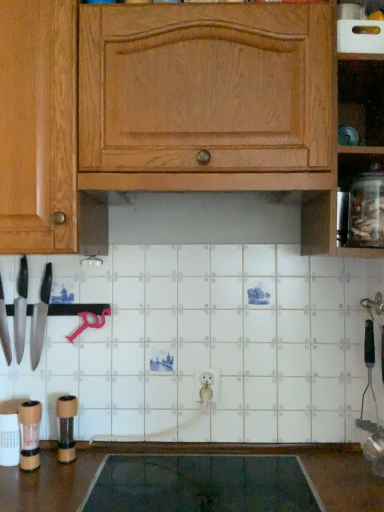
Describe the element at coordinates (29, 434) in the screenshot. I see `wooden pepper grinder at lower left, arranged as the 2th appliance when viewed from the right` at that location.

Describe the element at coordinates (20, 310) in the screenshot. I see `polished silver knife at left, the 2th knife viewed from the left` at that location.

Where is `wooden pepper grinder at lower left, which appears as the 1th appliance when viewed from the left`? The image size is (384, 512). wooden pepper grinder at lower left, which appears as the 1th appliance when viewed from the left is located at coordinates (29, 434).

From a real-world perspective, does shiny silver knife at left, which is the third knife in right-to-left order, sit lower than dark gray rubber mat at lower center?

No, from a real-world perspective, shiny silver knife at left, which is the third knife in right-to-left order, is not under dark gray rubber mat at lower center.

Consider the image. Considering the sizes of objects shiny silver knife at left, which appears as the 1th knife when viewed from the left, and dark gray rubber mat at lower center in the image provided, who is thinner, shiny silver knife at left, which appears as the 1th knife when viewed from the left, or dark gray rubber mat at lower center?

shiny silver knife at left, which appears as the 1th knife when viewed from the left, is thinner.

Are shiny silver knife at left, which is the third knife in right-to-left order, and dark gray rubber mat at lower center beside each other?

shiny silver knife at left, which is the third knife in right-to-left order, is not next to dark gray rubber mat at lower center, and they're not touching.

Are wooden pepper grinder at lower left, which appears as the 1th appliance when viewed from the left, and matte black knife at left, marked as the 3th knife in a left-to-right arrangement, far apart?

No.

Is wooden pepper grinder at lower left, arranged as the 2th appliance when viewed from the right, thinner than matte black knife at left, marked as the 3th knife in a left-to-right arrangement?

Correct, the width of wooden pepper grinder at lower left, arranged as the 2th appliance when viewed from the right, is less than that of matte black knife at left, marked as the 3th knife in a left-to-right arrangement.

Based on the photo, considering the positions of objects wooden pepper grinder at lower left, which is counted as the second appliance, starting from the back, and matte black knife at left, marked as the 3th knife in a left-to-right arrangement, in the image provided, who is in front, wooden pepper grinder at lower left, which is counted as the second appliance, starting from the back, or matte black knife at left, marked as the 3th knife in a left-to-right arrangement,?

wooden pepper grinder at lower left, which is counted as the second appliance, starting from the back, is closer to the camera.

Which is less distant, (327, 459) or (207, 18)?

Point (327, 459) is farther from the camera than point (207, 18).

From a real-world perspective, which object rests below the other?

dark gray rubber mat at lower center.

From the picture: Is shiny silver knife at left, which is the third knife in right-to-left order, positioned far away from brown matte pepper grinder at lower left, positioned as the second appliance in front-to-back order?

No, shiny silver knife at left, which is the third knife in right-to-left order, is in close proximity to brown matte pepper grinder at lower left, positioned as the second appliance in front-to-back order.

Considering the positions of objects shiny silver knife at left, which appears as the 1th knife when viewed from the left, and brown matte pepper grinder at lower left, placed as the first appliance when sorted from right to left, in the image provided, who is more to the left, shiny silver knife at left, which appears as the 1th knife when viewed from the left, or brown matte pepper grinder at lower left, placed as the first appliance when sorted from right to left,?

Positioned to the left is shiny silver knife at left, which appears as the 1th knife when viewed from the left.

What's the angular difference between shiny silver knife at left, which is the third knife in right-to-left order, and brown matte pepper grinder at lower left, positioned as the second appliance in left-to-right order,'s facing directions?

6.64 degrees.

Is shiny silver knife at left, which appears as the 1th knife when viewed from the left, not inside brown matte pepper grinder at lower left, positioned as the second appliance in front-to-back order?

Yes.

Could you tell me if clear glass jar at right is turned towards dark gray rubber mat at lower center?

No, clear glass jar at right does not turn towards dark gray rubber mat at lower center.

Does clear glass jar at right lie in front of dark gray rubber mat at lower center?

No, clear glass jar at right is further to the viewer.

Could dark gray rubber mat at lower center be considered to be inside clear glass jar at right?

No, dark gray rubber mat at lower center is not a part of clear glass jar at right.

From the image's perspective, is clear glass jar at right located above or below dark gray rubber mat at lower center?

clear glass jar at right is situated higher than dark gray rubber mat at lower center in the image.

Is brown matte pepper grinder at lower left, which is the first appliance from back to front, wider or thinner than wooden pepper grinder at lower left, which appears as the 1th appliance when viewed from the left?

Clearly, brown matte pepper grinder at lower left, which is the first appliance from back to front, has more width compared to wooden pepper grinder at lower left, which appears as the 1th appliance when viewed from the left.

Which is more to the right, brown matte pepper grinder at lower left, placed as the first appliance when sorted from right to left, or wooden pepper grinder at lower left, which is counted as the second appliance, starting from the back?

brown matte pepper grinder at lower left, placed as the first appliance when sorted from right to left, is more to the right.

Between point (72, 396) and point (31, 467), which one is positioned behind?

The point (72, 396) is more distant.

From the image's perspective, between brown matte pepper grinder at lower left, which is the first appliance from back to front, and wooden pepper grinder at lower left, which appears as the 1th appliance when viewed from the left, who is located below?

brown matte pepper grinder at lower left, which is the first appliance from back to front, appears lower in the image.

Is clear glass jar at right taller than wooden pepper grinder at lower left, arranged as the 2th appliance when viewed from the right?

Indeed, clear glass jar at right has a greater height compared to wooden pepper grinder at lower left, arranged as the 2th appliance when viewed from the right.

Which is in front, clear glass jar at right or wooden pepper grinder at lower left, which appears as the 1th appliance when viewed from the left?

clear glass jar at right.

Between point (377, 183) and point (26, 403), which one is positioned behind?

The point (26, 403) is farther from the camera.

Can you tell me how much clear glass jar at right and wooden pepper grinder at lower left, arranged as the 2th appliance when viewed from the right, differ in facing direction?

There is a 1.91-degree angle between the facing directions of clear glass jar at right and wooden pepper grinder at lower left, arranged as the 2th appliance when viewed from the right.

The image size is (384, 512). Identify the location of the 3rd knife directly above the dark gray rubber mat at lower center (from a real-world perspective). (4, 328).

Find the location of a particular element. appliance that is the 1st one when counting downward from the matte black knife at left, the 1th knife when ordered from right to left (from the image's perspective) is located at coordinates (29, 434).

From the picture: Which object lies further to the anchor point wooden pepper grinder at lower left, the 1th appliance from the front, clear glass jar at right or wooden cabinet at upper center?

Among the two, clear glass jar at right is located further to wooden pepper grinder at lower left, the 1th appliance from the front.

Estimate the real-world distances between objects in this image. Which object is further from polished silver knife at left, the 2th knife viewed from the left, matte black knife at left, marked as the 3th knife in a left-to-right arrangement, or dark gray rubber mat at lower center?

The object further to polished silver knife at left, the 2th knife viewed from the left, is dark gray rubber mat at lower center.

Estimate the real-world distances between objects in this image. Which object is further from wooden cabinet at upper center, wooden pepper grinder at lower left, the 1th appliance from the front, or shiny silver knife at left, which is the third knife in right-to-left order?

Based on the image, wooden pepper grinder at lower left, the 1th appliance from the front, appears to be further to wooden cabinet at upper center.

Based on the photo, considering their positions, is wooden pepper grinder at lower left, arranged as the 2th appliance when viewed from the right, positioned closer to wooden cabinet at upper center than dark gray rubber mat at lower center?

Based on the image, wooden pepper grinder at lower left, arranged as the 2th appliance when viewed from the right, appears to be nearer to wooden cabinet at upper center.

Looking at the image, which one is located closer to polished silver knife at left, the 2th knife viewed from the right, matte black knife at left, the 1th knife when ordered from right to left, or wooden cabinet at upper center?

matte black knife at left, the 1th knife when ordered from right to left, is closer to polished silver knife at left, the 2th knife viewed from the right.

From the picture: Considering their positions, is polished silver knife at left, the 2th knife viewed from the left, positioned closer to wooden pepper grinder at lower left, which is counted as the second appliance, starting from the back, than matte black knife at left, the 1th knife when ordered from right to left?

matte black knife at left, the 1th knife when ordered from right to left.

From the image, which object appears to be nearer to polished silver knife at left, the 2th knife viewed from the right, clear glass jar at right or wooden pepper grinder at lower left, which is counted as the second appliance, starting from the back?

wooden pepper grinder at lower left, which is counted as the second appliance, starting from the back, is positioned closer to the anchor polished silver knife at left, the 2th knife viewed from the right.

Looking at the image, which one is located further to wooden pepper grinder at lower left, which is counted as the second appliance, starting from the back, shiny silver knife at left, which appears as the 1th knife when viewed from the left, or polished silver knife at left, the 2th knife viewed from the left?

polished silver knife at left, the 2th knife viewed from the left, is positioned further to the anchor wooden pepper grinder at lower left, which is counted as the second appliance, starting from the back.

The height and width of the screenshot is (512, 384). What are the coordinates of `appliance between polished silver knife at left, the 2th knife viewed from the right, and brown matte pepper grinder at lower left, placed as the first appliance when sorted from right to left, in the up-down direction` in the screenshot? It's located at (29, 434).

Find the location of a particular element. glass jar that lies between wooden cabinet at upper center and dark gray rubber mat at lower center from top to bottom is located at coordinates tap(367, 209).

You are a GUI agent. You are given a task and a screenshot of the screen. Output one action in this format:
    pyautogui.click(x=<x>, y=<y>)
    Task: Click on the appliance between wooden pepper grinder at lower left, the 1th appliance from the front, and dark gray rubber mat at lower center
    
    Given the screenshot: What is the action you would take?
    pyautogui.click(x=66, y=426)

At what (x,y) coordinates should I click in order to perform the action: click on cabinetry between polished silver knife at left, the 2th knife viewed from the right, and clear glass jar at right from left to right. Please return your answer as a coordinate pair (x, y). The image size is (384, 512). Looking at the image, I should click on (163, 110).